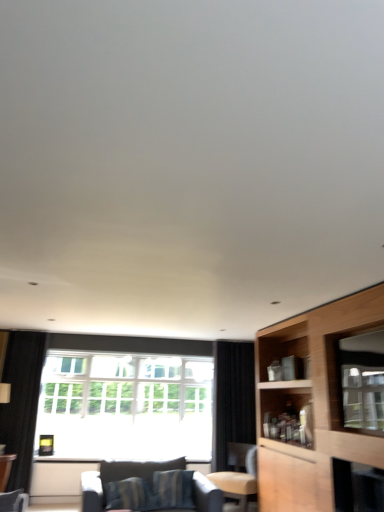
Question: From the image's perspective, is black fabric curtain at left, the 2th curtain from the right, positioned above or below light brown leather chair at center?

Choices:
 (A) above
 (B) below

Answer: (A)

Question: Does point (21, 481) appear closer or farther from the camera than point (251, 474)?

Choices:
 (A) farther
 (B) closer

Answer: (B)

Question: Considering the real-world distances, which object is farthest from the transparent glass window screen at right?

Choices:
 (A) black fabric curtain at left, the 1th curtain viewed from the left
 (B) striped fabric couch at lower center
 (C) wooden cabinet at right
 (D) wooden table at lower left
 (E) clear glass window at center

Answer: (D)

Question: Estimate the real-world distances between objects in this image. Which object is closer to the black fabric curtain at center, which ranks as the 2th curtain in left-to-right order?

Choices:
 (A) wooden cabinet at right
 (B) light brown leather chair at center
 (C) wooden table at lower left
 (D) black fabric curtain at left, the 1th curtain viewed from the left
 (E) striped fabric couch at lower center

Answer: (B)